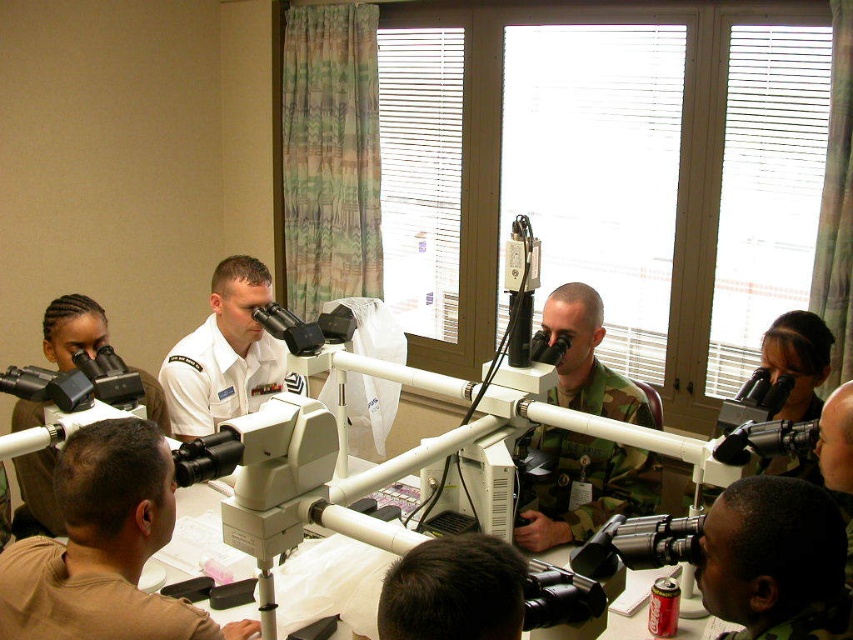
Question: Can you confirm if brown matte uniform at center is positioned to the left of camouflage uniform at center?

Choices:
 (A) yes
 (B) no

Answer: (A)

Question: Does brown matte uniform at center have a smaller size compared to camouflage uniform at center?

Choices:
 (A) yes
 (B) no

Answer: (A)

Question: Is brown matte uniform at center smaller than white uniform at center?

Choices:
 (A) no
 (B) yes

Answer: (B)

Question: Considering the real-world distances, which object is closest to the brown matte uniform at center?

Choices:
 (A) camouflage uniform at center
 (B) white uniform at center

Answer: (B)

Question: Considering the real-world distances, which object is farthest from the white uniform at center?

Choices:
 (A) camouflage uniform at center
 (B) brown matte uniform at center

Answer: (B)

Question: Which object is closer to the camera taking this photo?

Choices:
 (A) brown matte uniform at center
 (B) white uniform at center
 (C) camouflage uniform at center

Answer: (A)